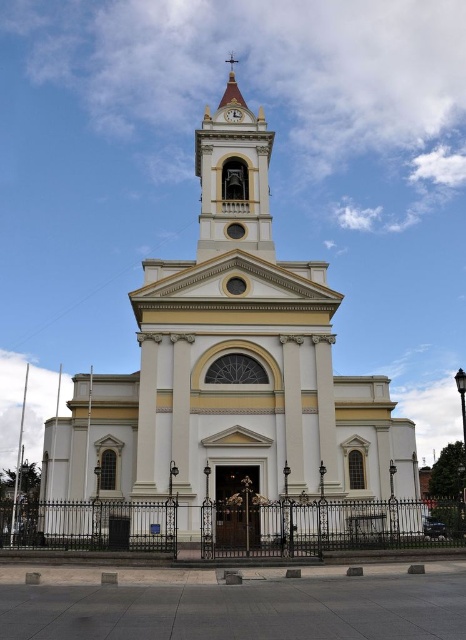
You are standing in front of the church and want to know where the smooth cream steeple at center is in relation to the white textured clock at center. Can you tell me their positions?

The smooth cream steeple at center is located above the white textured clock at center.